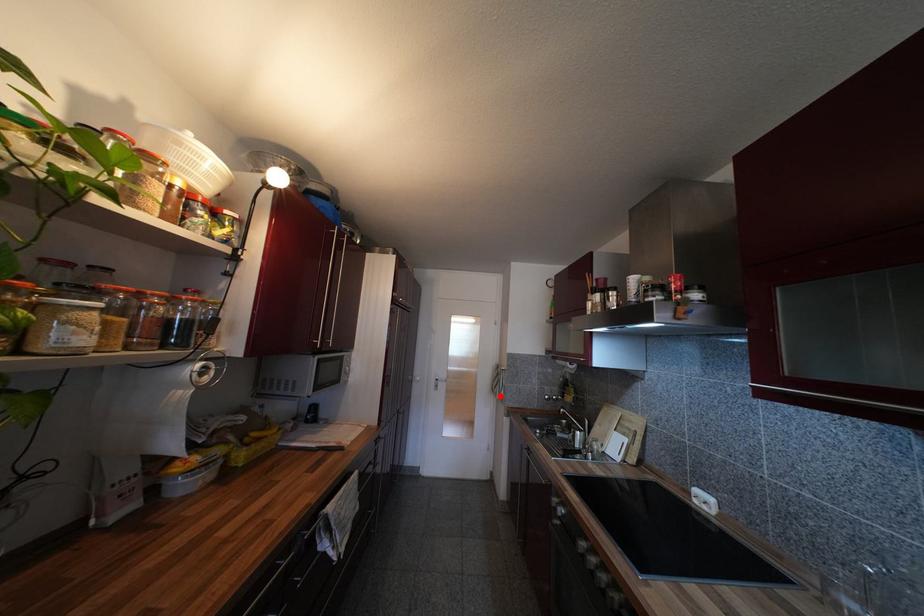
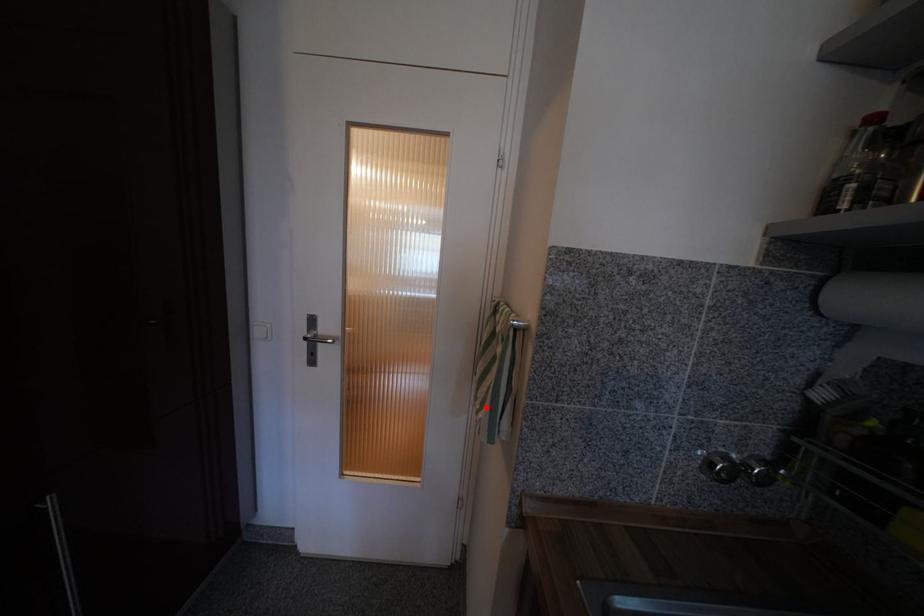
I am providing you with two images of the same scene from different viewpoints. A red point is marked on the first image and another point is marked on the second image. Does the point marked in image1 correspond to the same location as the one in image2?

Yes